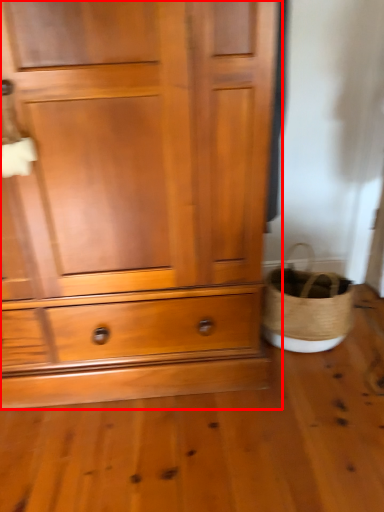
Question: From the image's perspective, where is chest of drawers (annotated by the red box) located in relation to basket in the image?

Choices:
 (A) below
 (B) above

Answer: (B)